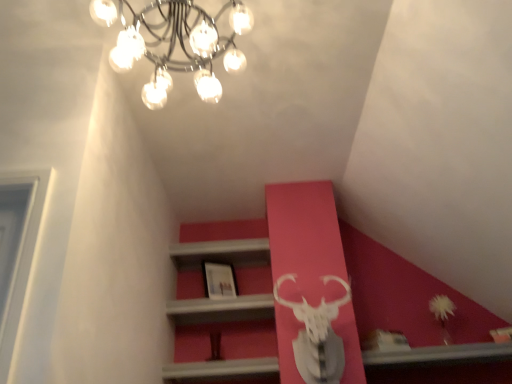
The image size is (512, 384). Describe the element at coordinates (176, 43) in the screenshot. I see `metallic chandelier at upper center` at that location.

You are a GUI agent. You are given a task and a screenshot of the screen. Output one action in this format:
    pyautogui.click(x=<x>, y=<y>)
    Task: Click on the metallic chandelier at upper center
    The image size is (512, 384).
    Given the screenshot: What is the action you would take?
    pyautogui.click(x=176, y=43)

What is the approximate width of metallic chandelier at upper center?

metallic chandelier at upper center is 20.47 inches wide.

In order to click on matte white picture frame at center in this screenshot , I will do `click(219, 280)`.

Image resolution: width=512 pixels, height=384 pixels. What do you see at coordinates (219, 280) in the screenshot? I see `matte white picture frame at center` at bounding box center [219, 280].

Find the location of a particular element. metallic chandelier at upper center is located at coordinates (176, 43).

Between matte white picture frame at center and metallic chandelier at upper center, which one appears on the left side from the viewer's perspective?

From the viewer's perspective, metallic chandelier at upper center appears more on the left side.

Which object is further away from the camera taking this photo, matte white picture frame at center or metallic chandelier at upper center?

matte white picture frame at center is more distant.

Considering the points (227, 294) and (156, 94), which point is in front, point (227, 294) or point (156, 94)?

Positioned in front is point (156, 94).

From the image's perspective, which is below, matte white picture frame at center or metallic chandelier at upper center?

matte white picture frame at center, from the image's perspective.

From a real-world perspective, is matte white picture frame at center positioned under metallic chandelier at upper center based on gravity?

Yes.

Which object is wider, matte white picture frame at center or metallic chandelier at upper center?

metallic chandelier at upper center is wider.

Does matte white picture frame at center have a greater height compared to metallic chandelier at upper center?

In fact, matte white picture frame at center may be shorter than metallic chandelier at upper center.

Is matte white picture frame at center smaller than metallic chandelier at upper center?

Correct, matte white picture frame at center occupies less space than metallic chandelier at upper center.

Is matte white picture frame at center not inside metallic chandelier at upper center?

Indeed, matte white picture frame at center is completely outside metallic chandelier at upper center.

Is matte white picture frame at center directly adjacent to metallic chandelier at upper center?

No, matte white picture frame at center is not next to metallic chandelier at upper center.

Does matte white picture frame at center turn towards metallic chandelier at upper center?

No, matte white picture frame at center is not oriented towards metallic chandelier at upper center.

Where is `picture frame behind the metallic chandelier at upper center`? The image size is (512, 384). picture frame behind the metallic chandelier at upper center is located at coordinates (219, 280).

Is metallic chandelier at upper center at the right side of matte white picture frame at center?

Incorrect, metallic chandelier at upper center is not on the right side of matte white picture frame at center.

Which is in front, metallic chandelier at upper center or matte white picture frame at center?

metallic chandelier at upper center is more forward.

Which is closer to the camera, (x=138, y=39) or (x=209, y=292)?

The point (x=138, y=39) is in front.

From the image's perspective, who appears lower, metallic chandelier at upper center or matte white picture frame at center?

matte white picture frame at center.

From a real-world perspective, which object rests below the other?

From a 3D spatial view, matte white picture frame at center is below.

Between metallic chandelier at upper center and matte white picture frame at center, which one has larger width?

metallic chandelier at upper center is wider.

Does metallic chandelier at upper center have a lesser height compared to matte white picture frame at center?

In fact, metallic chandelier at upper center may be taller than matte white picture frame at center.

Does metallic chandelier at upper center have a smaller size compared to matte white picture frame at center?

Incorrect, metallic chandelier at upper center is not smaller in size than matte white picture frame at center.

Does metallic chandelier at upper center contain matte white picture frame at center?

That's incorrect, matte white picture frame at center is not inside metallic chandelier at upper center.

Is metallic chandelier at upper center not close to matte white picture frame at center?

metallic chandelier at upper center is far away from matte white picture frame at center.

Could you tell me if metallic chandelier at upper center is turned towards matte white picture frame at center?

No, metallic chandelier at upper center is not turned towards matte white picture frame at center.

Measure the distance from metallic chandelier at upper center to matte white picture frame at center.

A distance of 4.98 feet exists between metallic chandelier at upper center and matte white picture frame at center.

Locate an element on the screen. Image resolution: width=512 pixels, height=384 pixels. picture frame that is below the metallic chandelier at upper center (from the image's perspective) is located at coordinates (219, 280).

Locate an element on the screen. This screenshot has height=384, width=512. picture frame located on the right of metallic chandelier at upper center is located at coordinates (219, 280).

Locate an element on the screen. lamp that appears in front of the matte white picture frame at center is located at coordinates 176,43.